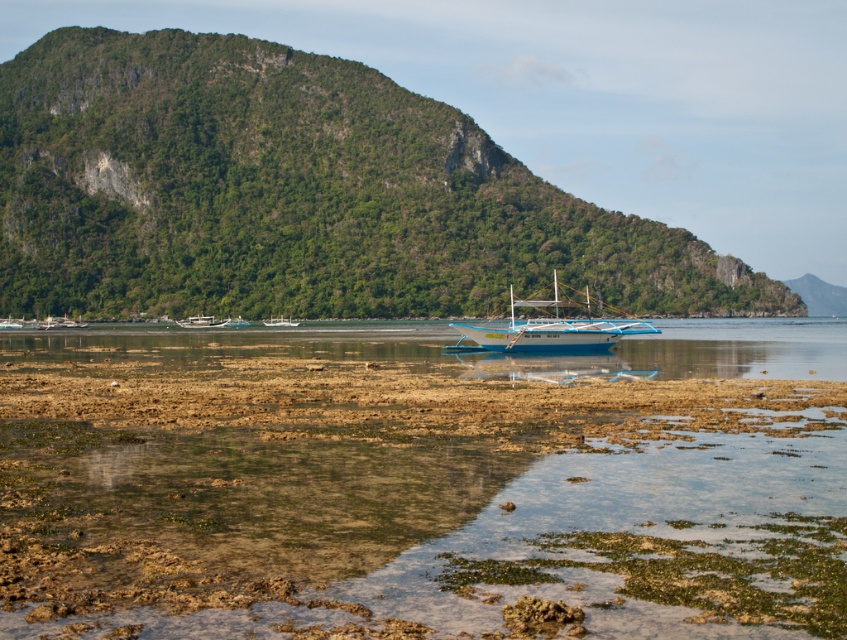
Question: Among these objects, which one is farthest from the camera?

Choices:
 (A) green textured mountain at center
 (B) blue polished wood boat at center
 (C) white glossy boat at center
 (D) green leafy mountain at right

Answer: (D)

Question: Does blue polished wood boat at center appear on the left side of wooden boat at center?

Choices:
 (A) yes
 (B) no

Answer: (B)

Question: Is blue polished wood boat at center thinner than white glossy boat at center?

Choices:
 (A) no
 (B) yes

Answer: (A)

Question: Which object is closer to the camera taking this photo?

Choices:
 (A) white glossy boat at center
 (B) wooden boat at center

Answer: (A)

Question: Observing the image, what is the correct spatial positioning of blue polished wood boat at center in reference to white glossy boat at center?

Choices:
 (A) above
 (B) below

Answer: (A)

Question: Estimate the real-world distances between objects in this image. Which object is farther from the blue polished wood boat at center?

Choices:
 (A) green leafy mountain at right
 (B) green textured mountain at center

Answer: (A)